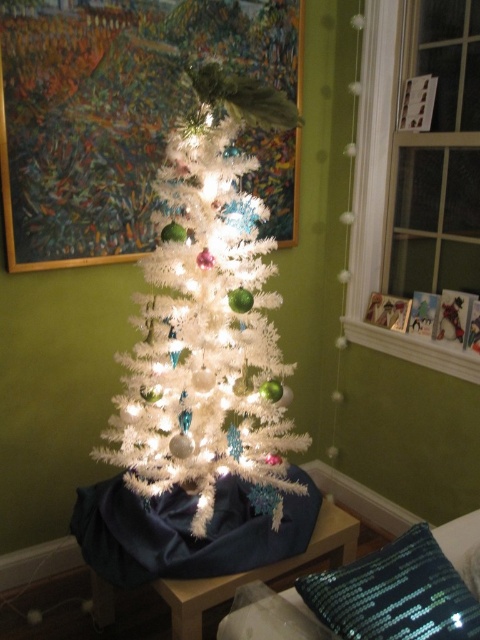
Is painted wood picture frame at upper center below sparkly sequined pillow at lower right?

No.

Between point (126, 115) and point (409, 618), which one is positioned in front?

Point (409, 618)

The image size is (480, 640). I want to click on painted wood picture frame at upper center, so click(112, 112).

Which is above, painted wood picture frame at upper center or white fluffy christmas tree at center?

Positioned higher is painted wood picture frame at upper center.

Can you confirm if painted wood picture frame at upper center is shorter than white fluffy christmas tree at center?

Yes.

Who is more distant from viewer, (2, 170) or (191, 138)?

Point (2, 170)

Locate an element on the screen. This screenshot has height=640, width=480. painted wood picture frame at upper center is located at coordinates (112, 112).

Who is more distant from viewer, (120, 400) or (360, 620)?

Positioned behind is point (120, 400).

Is white fluffy christmas tree at center above sparkly sequined pillow at lower right?

Correct, white fluffy christmas tree at center is located above sparkly sequined pillow at lower right.

Image resolution: width=480 pixels, height=640 pixels. What are the coordinates of `white fluffy christmas tree at center` in the screenshot? It's located at (208, 320).

You are a GUI agent. You are given a task and a screenshot of the screen. Output one action in this format:
    pyautogui.click(x=<x>, y=<y>)
    Task: Click on the white fluffy christmas tree at center
    The height and width of the screenshot is (640, 480).
    Given the screenshot: What is the action you would take?
    pyautogui.click(x=208, y=320)